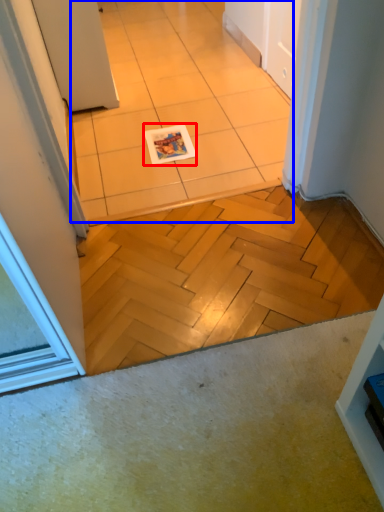
Question: Which of the following is the closest to the observer, magazine (highlighted by a red box) or ceramic tile (highlighted by a blue box)?

Choices:
 (A) magazine
 (B) ceramic tile

Answer: (B)